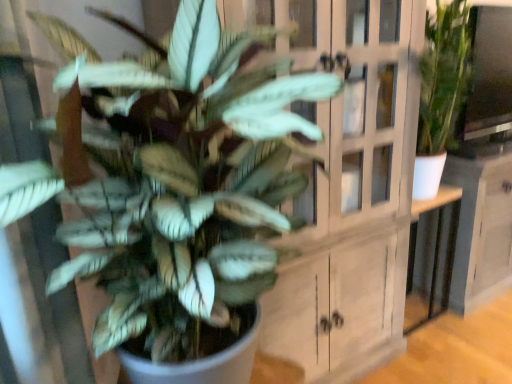
Question: From a real-world perspective, is white wood cabinet at center positioned over green matte plant at center based on gravity?

Choices:
 (A) no
 (B) yes

Answer: (A)

Question: Is white wood cabinet at center outside of green matte plant at center?

Choices:
 (A) yes
 (B) no

Answer: (A)

Question: From the image's perspective, would you say white wood cabinet at center is positioned over green matte plant at center?

Choices:
 (A) yes
 (B) no

Answer: (A)

Question: Is green matte plant at center located within white wood cabinet at center?

Choices:
 (A) no
 (B) yes

Answer: (A)

Question: Considering the relative sizes of white wood cabinet at center and green matte plant at center in the image provided, is white wood cabinet at center taller than green matte plant at center?

Choices:
 (A) no
 (B) yes

Answer: (B)

Question: Considering the relative sizes of white wood cabinet at center and green matte plant at center in the image provided, is white wood cabinet at center thinner than green matte plant at center?

Choices:
 (A) no
 (B) yes

Answer: (B)

Question: From the image's perspective, does green matte plant at center appear higher than white glossy table at center?

Choices:
 (A) no
 (B) yes

Answer: (B)

Question: Considering the relative sizes of green matte plant at center and white glossy table at center in the image provided, is green matte plant at center taller than white glossy table at center?

Choices:
 (A) no
 (B) yes

Answer: (B)

Question: Is green matte plant at center closer to the viewer compared to white glossy table at center?

Choices:
 (A) no
 (B) yes

Answer: (B)

Question: Is green matte plant at center looking in the opposite direction of white glossy table at center?

Choices:
 (A) no
 (B) yes

Answer: (A)

Question: Considering the relative sizes of green matte plant at center and white glossy table at center in the image provided, is green matte plant at center bigger than white glossy table at center?

Choices:
 (A) yes
 (B) no

Answer: (A)

Question: Does green matte plant at center appear on the left side of white glossy table at center?

Choices:
 (A) no
 (B) yes

Answer: (B)

Question: Are white wood cabinet at center and white glossy table at center located far from each other?

Choices:
 (A) yes
 (B) no

Answer: (B)